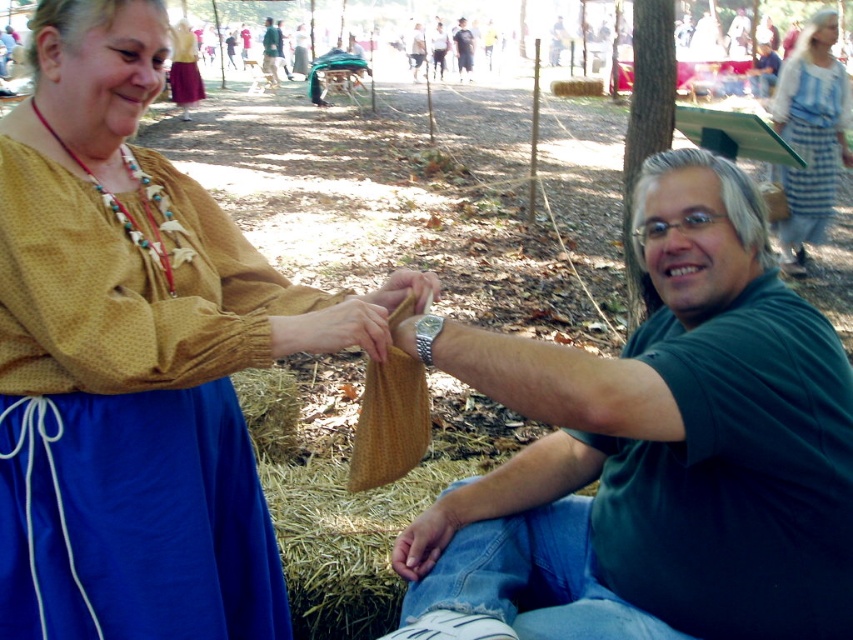
Question: Which of these objects is positioned farthest from the matte yellow blouse at center?

Choices:
 (A) green fabric bag at center
 (B) dark blue jeans at center

Answer: (B)

Question: Which of these objects is positioned farthest from the dark blue jeans at center?

Choices:
 (A) matte yellow blouse at center
 (B) green fabric bag at center
 (C) matte brown bag at center

Answer: (C)

Question: Is smooth brown cloth at center smaller than matte yellow blouse at upper left?

Choices:
 (A) yes
 (B) no

Answer: (A)

Question: Is green fabric bag at center behind dark blue jeans at center?

Choices:
 (A) no
 (B) yes

Answer: (A)

Question: Among these points, which one is nearest to the camera?

Choices:
 (A) (373, 355)
 (B) (262, 49)
 (C) (387, 285)

Answer: (A)

Question: Is matte brown bag at center thinner than matte yellow blouse at upper left?

Choices:
 (A) yes
 (B) no

Answer: (B)